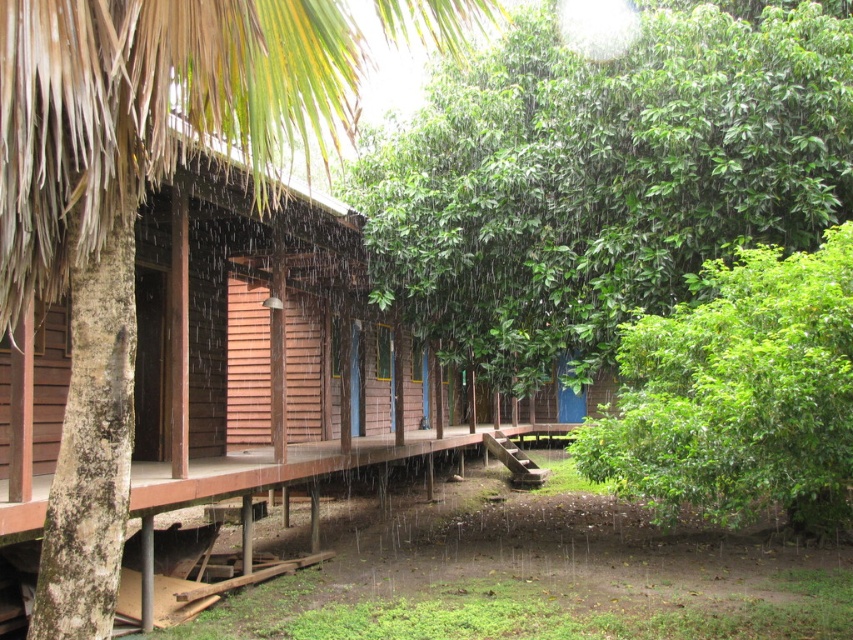
Looking at this image, you are a guest staying in one of the cabins and want to take a photo of the green leafy tree at center and the brown textured palm leaf at upper left. Which object will appear closer to the camera in the photo?

The green leafy tree at center will appear closer to the camera in the photo because the brown textured palm leaf at upper left is behind it.

You are standing at the center of the image and see a green leafy tree at center. Can you confirm if the tree is located exactly at the point coordinates given as point [605,177]?

The green leafy tree at center is located exactly at point coordinates [605,177].